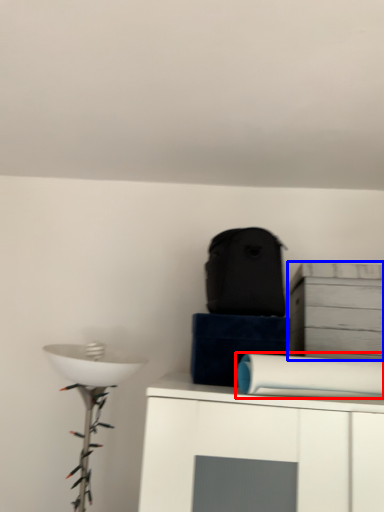
Question: Which object is further to the camera taking this photo, toilet paper (highlighted by a red box) or cabinetry (highlighted by a blue box)?

Choices:
 (A) toilet paper
 (B) cabinetry

Answer: (B)